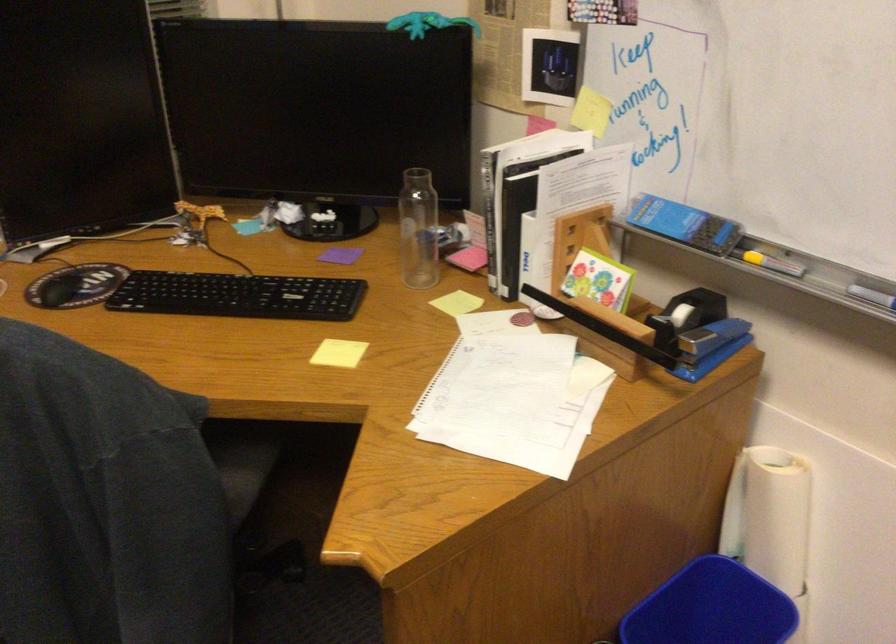
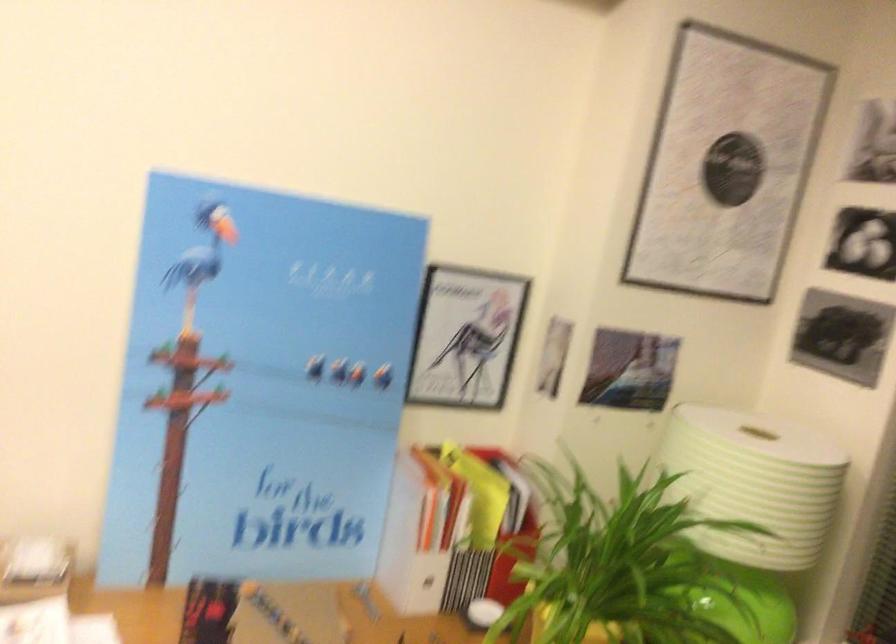
Question: The camera is either moving clockwise (left) or counter-clockwise (right) around the object. The first image is from the beginning of the video and the second image is from the end. Is the camera moving left or right when shooting the video?

Choices:
 (A) Left
 (B) Right

Answer: (B)